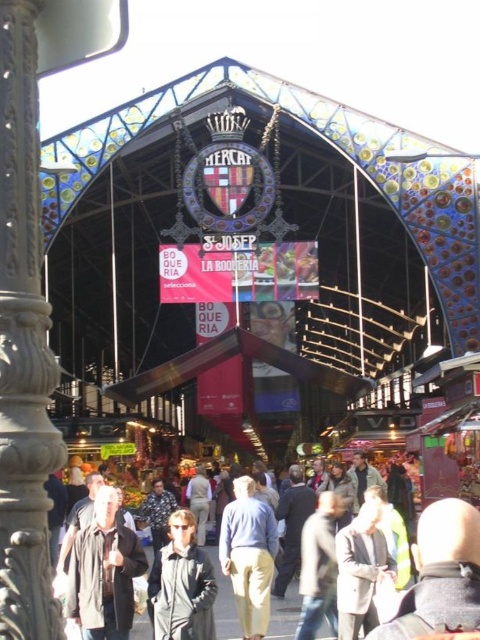
Question: In this image, where is dark gray jacket at center located relative to light beige coat at center?

Choices:
 (A) below
 (B) above

Answer: (B)

Question: Which point is closer to the camera taking this photo?

Choices:
 (A) (350, 556)
 (B) (111, 589)

Answer: (B)

Question: Is the position of light brown leather jacket at center more distant than that of light gray wool coat at center?

Choices:
 (A) yes
 (B) no

Answer: (B)

Question: Estimate the real-world distances between objects in this image. Which object is closer to the light beige coat at center?

Choices:
 (A) dark gray jacket at center
 (B) light blue fabric pants at center

Answer: (A)

Question: Estimate the real-world distances between objects in this image. Which object is farther from the light beige coat at center?

Choices:
 (A) dark gray jacket at center
 (B) light gray wool coat at center
 (C) light blue fabric pants at center
 (D) light brown leather jacket at center

Answer: (B)

Question: Can you confirm if light brown leather jacket at center is thinner than light gray wool coat at center?

Choices:
 (A) yes
 (B) no

Answer: (B)